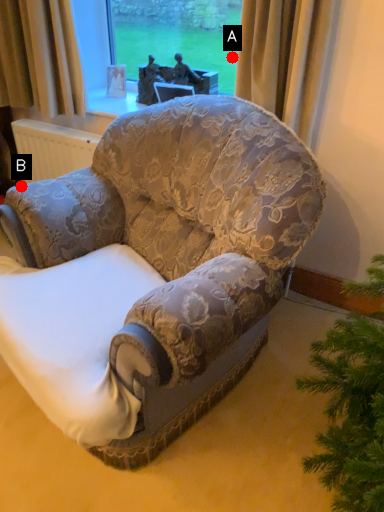
Question: Two points are circled on the image, labeled by A and B beside each circle. Which point is closer to the camera taking this photo?

Choices:
 (A) A is closer
 (B) B is closer

Answer: (B)